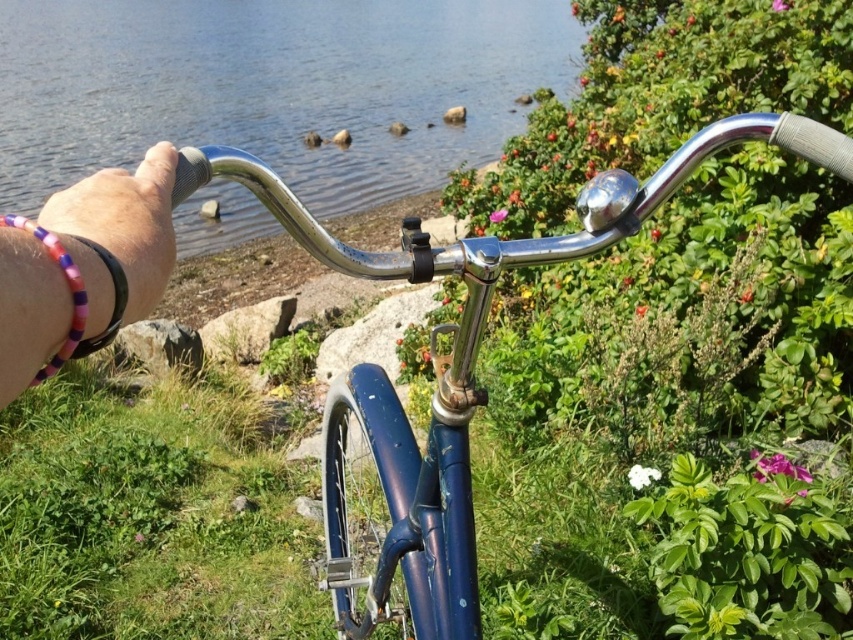
Is multicolored beaded bracelet at left behind purple beaded bracelet at left?

No, it is in front of purple beaded bracelet at left.

Does multicolored beaded bracelet at left have a greater width compared to purple beaded bracelet at left?

Indeed, multicolored beaded bracelet at left has a greater width compared to purple beaded bracelet at left.

Does point (91, 214) come in front of point (122, 278)?

No.

The width and height of the screenshot is (853, 640). I want to click on multicolored beaded bracelet at left, so click(x=125, y=221).

Identify the location of multicolored beaded bracelet at left. (125, 221).

Which is behind, point (169, 205) or point (85, 307)?

The point (169, 205) is behind.

Find the location of a particular element. multicolored beaded bracelet at left is located at coordinates (125, 221).

Does clear blue water at upper center have a lesser height compared to shiny blue bicycle at center?

No.

Can you confirm if clear blue water at upper center is positioned below shiny blue bicycle at center?

Actually, clear blue water at upper center is above shiny blue bicycle at center.

Where is `clear blue water at upper center`? This screenshot has height=640, width=853. clear blue water at upper center is located at coordinates (271, 86).